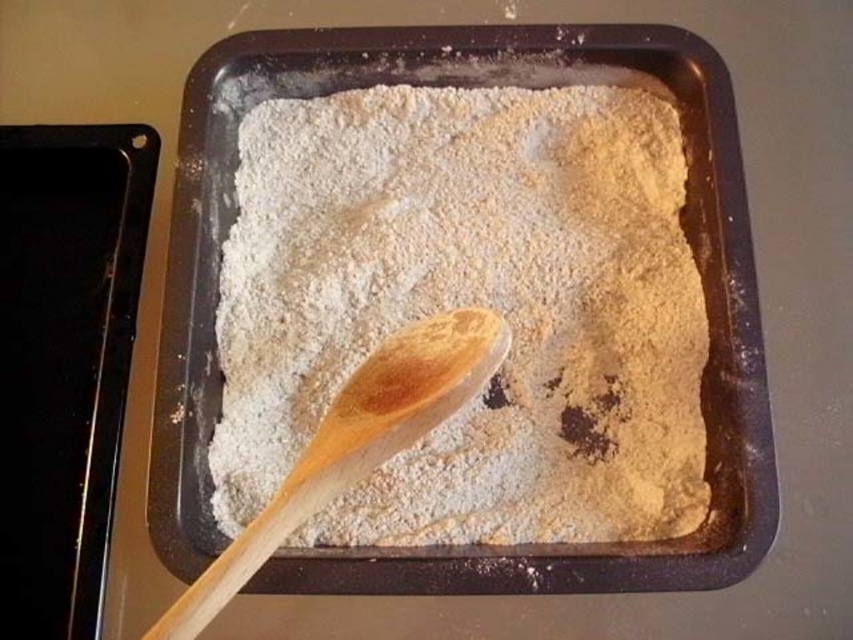
What is located at the point with coordinates (469, 305) in the baking tray?

The point at coordinates (469, 305) corresponds to light brown powder at center.

You are a baker trying to retrieve the wooden spoon at center from the baking tray. The light brown powder at center is in the way. Can you reach the spoon without moving the powder?

The wooden spoon at center is behind the light brown powder at center, so you can reach the spoon without moving the powder by accessing it from the sides or back where the powder isn